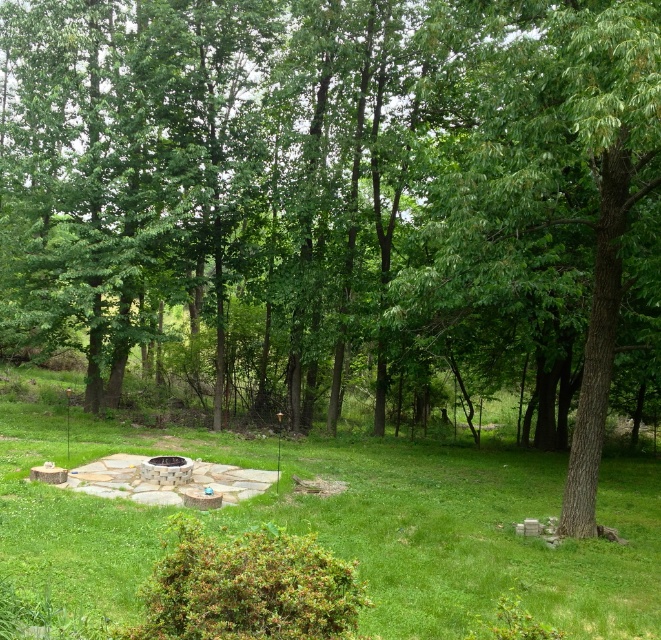
Is green grassy at center to the right of green rough bark tree at center from the viewer's perspective?

No, green grassy at center is not to the right of green rough bark tree at center.

Does green grassy at center have a lesser height compared to green rough bark tree at center?

In fact, green grassy at center may be taller than green rough bark tree at center.

Identify the location of green grassy at center. (469, 532).